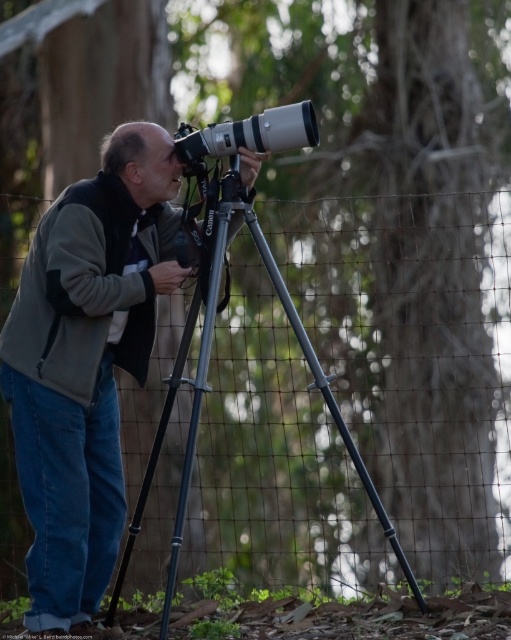
Question: Does matte gray jacket at center have a lesser width compared to metallic gray tripod at center?

Choices:
 (A) yes
 (B) no

Answer: (A)

Question: Which point is farther to the camera?

Choices:
 (A) (50, 324)
 (B) (164, 420)
 (C) (185, 147)

Answer: (B)

Question: Which of these objects is positioned closest to the matte gray jacket at center?

Choices:
 (A) matte silver lens at center
 (B) metallic gray tripod at center

Answer: (B)

Question: Does matte gray jacket at center appear under matte silver lens at center?

Choices:
 (A) no
 (B) yes

Answer: (B)

Question: Which object appears closest to the camera in this image?

Choices:
 (A) metallic gray tripod at center
 (B) matte gray jacket at center
 (C) matte silver lens at center

Answer: (A)

Question: From the image, what is the correct spatial relationship of matte gray jacket at center in relation to metallic gray tripod at center?

Choices:
 (A) above
 (B) below

Answer: (A)